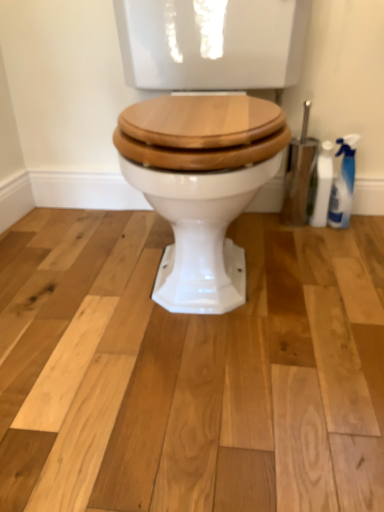
I want to click on vacant region to the left of translucent plastic spray bottle at right, arranged as the 1th cleaning product when viewed from the right, so click(284, 234).